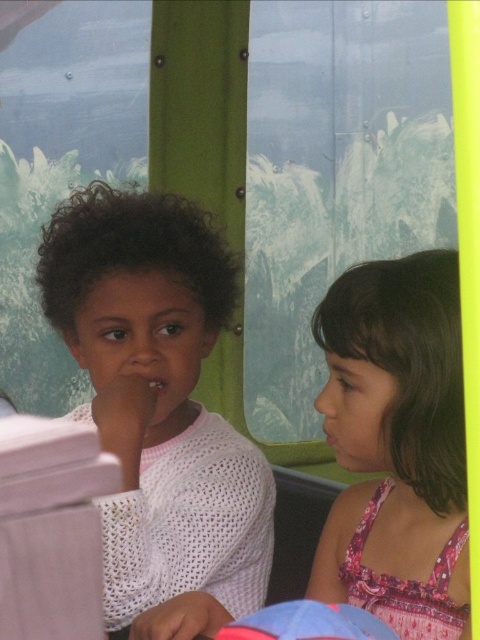
You are a photographer standing in front of the white knitted sweater at center and a camera. You want to take a photo of the sweater without the camera appearing in the shot. Can you move closer to the sweater to achieve this?

The white knitted sweater at center and camera are 31.87 inches apart from each other. If you move closer to the sweater, the distance between you and the camera would decrease, potentially causing the camera to appear in the frame. To avoid this, you should maintain a distance of at least 31.87 inches from the sweater to ensure the camera stays out of the shot.

You are a parent trying to hand a small toy to your child. The toy is currently placed between the white knitted sweater at center and the pink floral dress at right. If the toy is 2 inches long, can it fit entirely within the space between the two items?

The space between the white knitted sweater at center and the pink floral dress at right is 9.28 inches. Since the toy is only 2 inches long, it can easily fit within the space between them.

You are a tailor who needs to determine the appropriate fabric quantity for two garments. You observe a white knitted sweater at center and a pink floral dress at right in the image. Based on their sizes, which garment requires more fabric?

The white knitted sweater at center requires more fabric because it is larger in size than the pink floral dress at right.